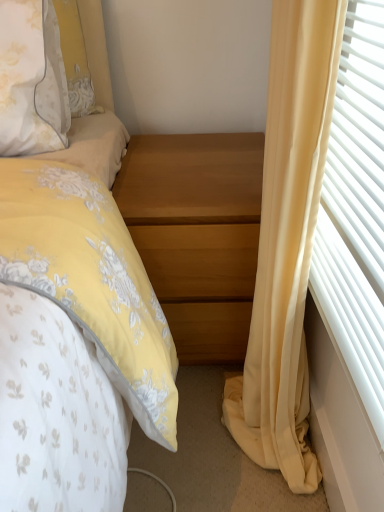
Question: Should I look upward or downward to see wooden nightstand at center?

Choices:
 (A) down
 (B) up

Answer: (B)